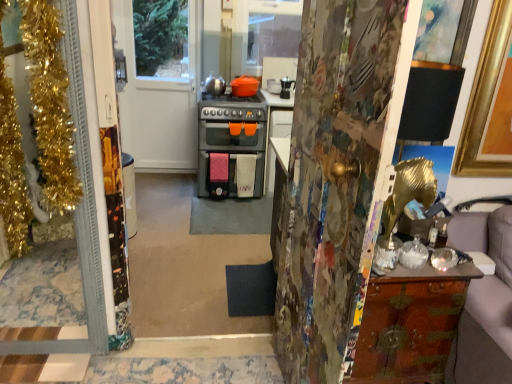
Question: From a real-world perspective, is wooden cabinet at right on gold tinsel at left, which is counted as the 2th door, starting from the front?

Choices:
 (A) no
 (B) yes

Answer: (A)

Question: Does wooden cabinet at right have a greater height compared to gold tinsel at left, which is counted as the 2th door, starting from the front?

Choices:
 (A) yes
 (B) no

Answer: (B)

Question: Is gold tinsel at left, which is counted as the 2th door, starting from the front, completely or partially inside wooden cabinet at right?

Choices:
 (A) yes
 (B) no

Answer: (B)

Question: Is wooden cabinet at right oriented away from gold tinsel at left, the 3th door viewed from the right?

Choices:
 (A) no
 (B) yes

Answer: (A)

Question: From the image's perspective, is wooden cabinet at right under gold tinsel at left, the 1th door viewed from the left?

Choices:
 (A) yes
 (B) no

Answer: (A)

Question: Does wooden cabinet at right come behind gold tinsel at left, the 3th door viewed from the right?

Choices:
 (A) no
 (B) yes

Answer: (B)

Question: Does wooden cabinet at right have a smaller size compared to painted wood door at center, placed as the first door when sorted from front to back?

Choices:
 (A) yes
 (B) no

Answer: (A)

Question: Does wooden cabinet at right have a lesser width compared to painted wood door at center, marked as the 1th door in a right-to-left arrangement?

Choices:
 (A) yes
 (B) no

Answer: (B)

Question: From the image's perspective, is wooden cabinet at right below painted wood door at center, placed as the first door when sorted from front to back?

Choices:
 (A) yes
 (B) no

Answer: (A)

Question: Is painted wood door at center, placed as the first door when sorted from front to back, surrounded by wooden cabinet at right?

Choices:
 (A) no
 (B) yes

Answer: (A)

Question: Is wooden cabinet at right looking in the opposite direction of painted wood door at center, marked as the 3th door in a left-to-right arrangement?

Choices:
 (A) no
 (B) yes

Answer: (A)

Question: From the image's perspective, would you say wooden cabinet at right is positioned over painted wood door at center, marked as the 3th door in a left-to-right arrangement?

Choices:
 (A) yes
 (B) no

Answer: (B)

Question: Does painted wood door at center, marked as the 1th door in a right-to-left arrangement, appear on the left side of wooden cabinet at right?

Choices:
 (A) yes
 (B) no

Answer: (A)